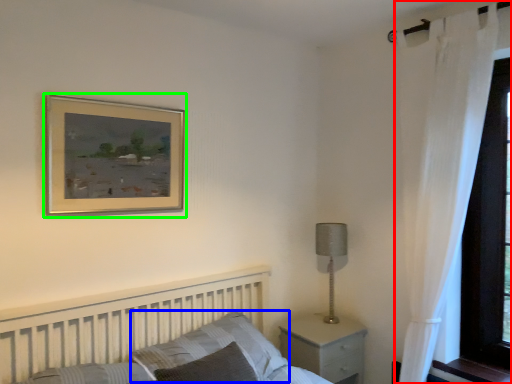
Question: Estimate the real-world distances between objects in this image. Which object is closer to curtain (highlighted by a red box), pillow (highlighted by a blue box) or picture frame (highlighted by a green box)?

Choices:
 (A) pillow
 (B) picture frame

Answer: (A)